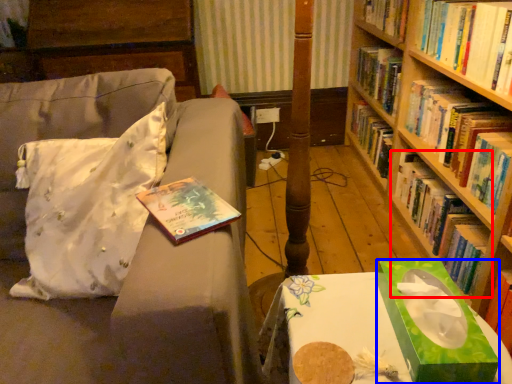
Question: Which object is further to the camera taking this photo, book (highlighted by a red box) or book cover (highlighted by a blue box)?

Choices:
 (A) book
 (B) book cover

Answer: (A)